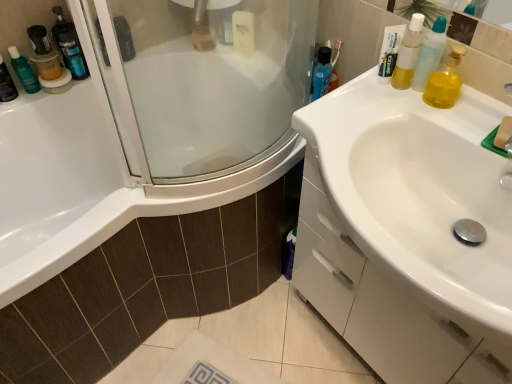
The width and height of the screenshot is (512, 384). I want to click on free space that is to the left of yellow translucent liquid at upper right, which is counted as the first toiletry, starting from the front, so click(x=367, y=102).